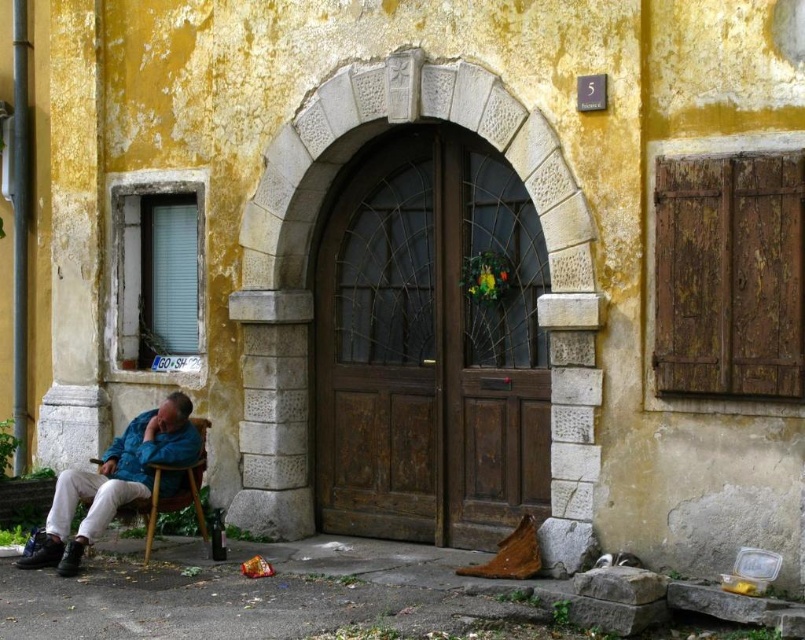
Question: Considering the real-world distances, which object is farthest from the wooden at left?

Choices:
 (A) wooden door at center
 (B) blue denim jacket at lower left
 (C) brown wooden door at center

Answer: (A)

Question: Is wooden door at center wider than blue denim jacket at lower left?

Choices:
 (A) no
 (B) yes

Answer: (A)

Question: Does brown wooden door at center have a larger size compared to blue denim jacket at lower left?

Choices:
 (A) yes
 (B) no

Answer: (A)

Question: Which is nearer to the blue denim jacket at lower left?

Choices:
 (A) brown wooden door at center
 (B) wooden door at center
 (C) wooden at left

Answer: (C)

Question: Can you confirm if brown wooden door at center is positioned above wooden at left?

Choices:
 (A) yes
 (B) no

Answer: (A)

Question: Which point is farther from the camera taking this photo?

Choices:
 (A) tap(515, 264)
 (B) tap(93, 481)
 (C) tap(147, 556)
 (D) tap(451, 177)

Answer: (D)